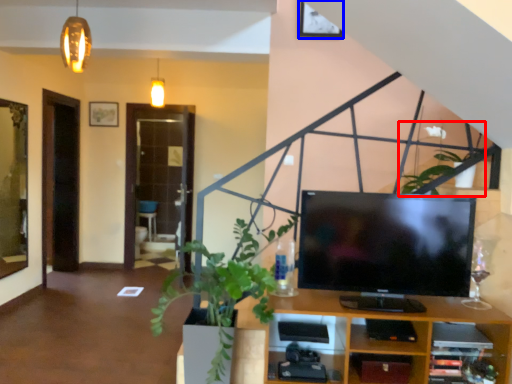
Question: Which point is further to the camera, plant (highlighted by a red box) or picture frame (highlighted by a blue box)?

Choices:
 (A) plant
 (B) picture frame

Answer: (B)